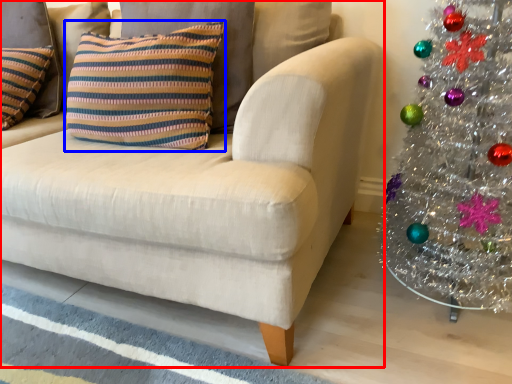
Question: Which object appears farthest to the camera in this image, studio couch (highlighted by a red box) or pillow (highlighted by a blue box)?

Choices:
 (A) studio couch
 (B) pillow

Answer: (B)